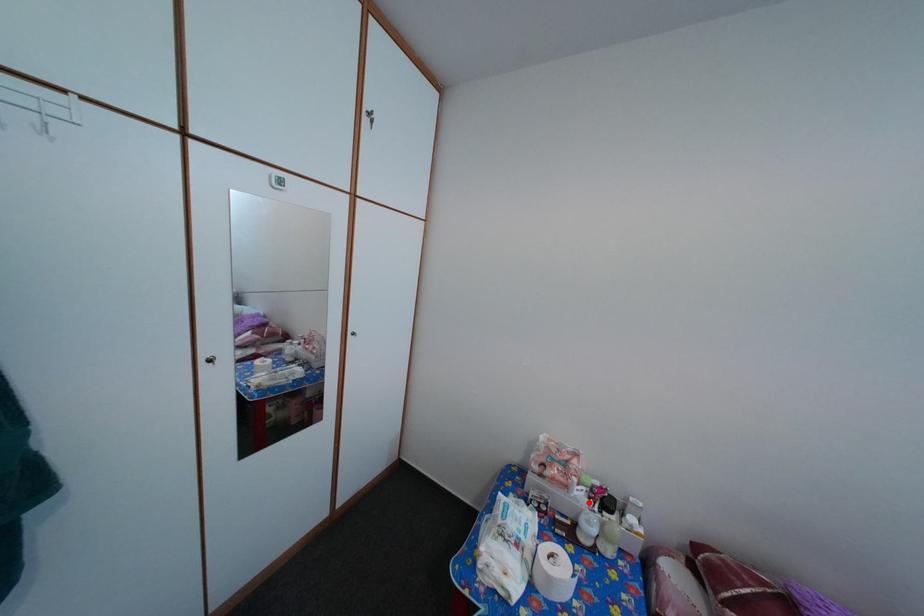
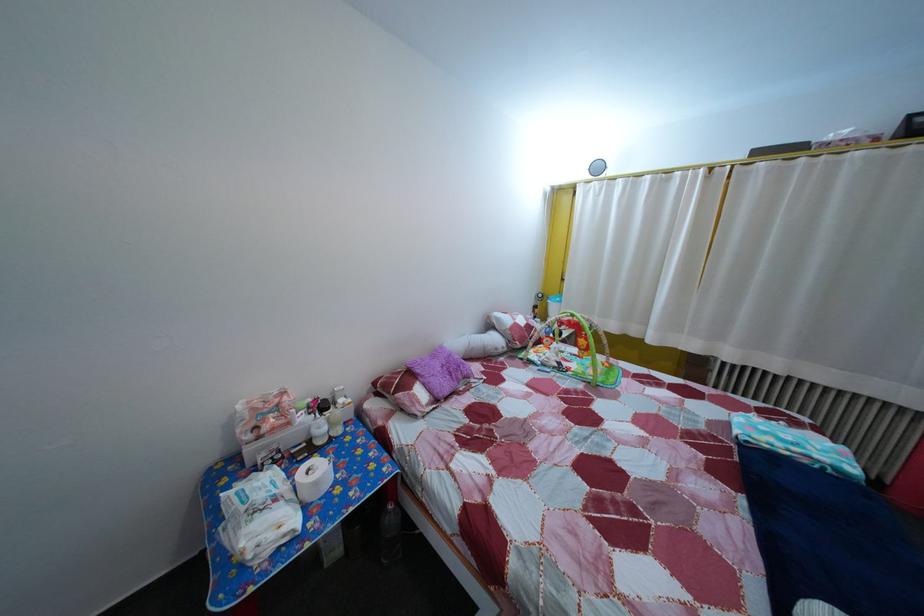
In the second image, find the point that corresponds to the highlighted location in the first image.

(311, 427)